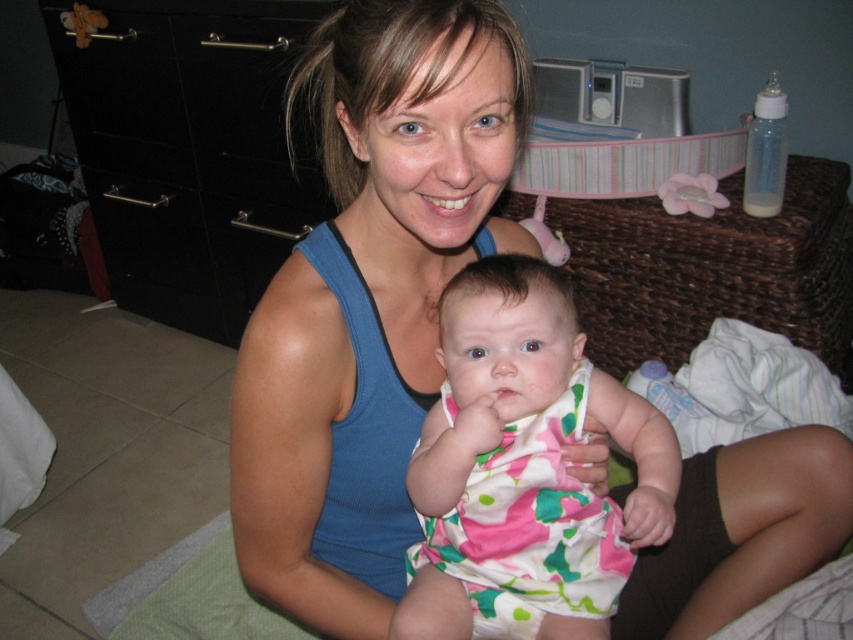
Consider the image. You are a photographer setting up a shoot in the room. You need to place a 1.5 meter tall backdrop behind the floral fabric dress at center so it won not be in the shot. Is the black glossy dresser at left blocking the placement?

The floral fabric dress at center is behind the black glossy dresser at left, so placing a backdrop behind the floral fabric dress at center would require positioning it further back than the black glossy dresser at left. Since the dresser is in front of the dress, the backdrop placed behind the dress would not be blocked by the dresser.

You are a photographer setting up a shoot in this room. You have a camera that can only focus on objects wider than 50 cm. You want to include both the black glossy dresser at left and the floral fabric dress at center in your shot. Which object should you prioritize to ensure it fits within the camera focus requirement?

The black glossy dresser at left should be prioritized because its width surpasses that of the floral fabric dress at center, making it more likely to meet the camera focus requirement of being wider than 50 cm.

You are a photographer trying to capture a closeup shot of both the blue fabric tank top at center and the floral fabric dress at center in the scene. Given that your camera can only focus on objects within a 4 inch range, will you be able to capture both items clearly in the same photo?

The blue fabric tank top at center is 3.79 inches away from the floral fabric dress at center. Since the distance between them is within the 4 inch focus range, the camera can capture both items clearly in the same photo.